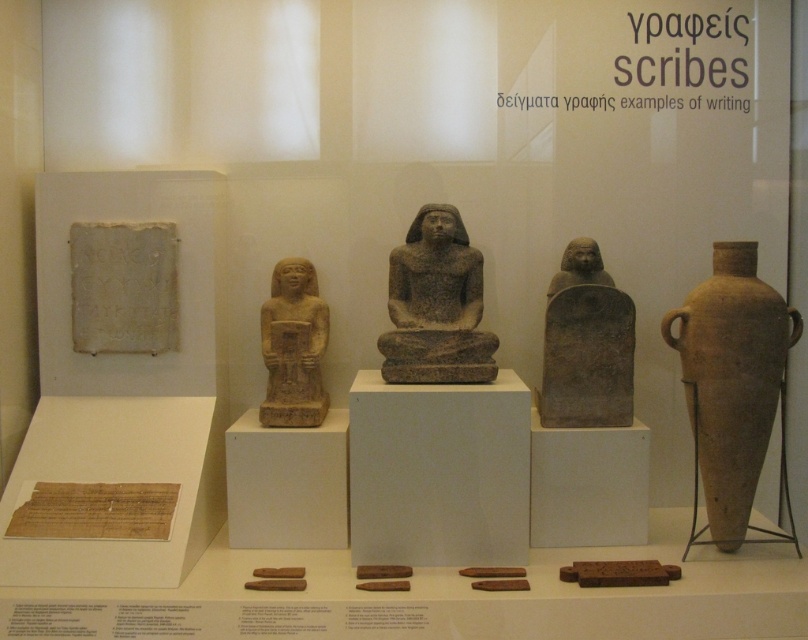
Can you confirm if brown matte vase at right is positioned to the right of beige stone statue at center?

Correct, you'll find brown matte vase at right to the right of beige stone statue at center.

Between point (781, 392) and point (306, 275), which one is positioned in front?

Point (781, 392)

I want to click on brown matte vase at right, so click(x=733, y=388).

Between brown matte vase at right and gray stone stele at center, which one is positioned higher?

gray stone stele at center is above.

Does point (697, 458) come farther from viewer compared to point (574, 368)?

No.

Which is in front, point (794, 339) or point (588, 346)?

Point (794, 339) is in front.

Locate an element on the screen. The image size is (808, 640). brown matte vase at right is located at coordinates (733, 388).

Is point (617, 372) positioned behind point (263, 358)?

No.

Is gray stone stele at center wider than beige stone statue at center?

Yes.

Does point (600, 410) lie in front of point (308, 308)?

Yes, point (600, 410) is closer to viewer.

Identify the location of gray stone stele at center. (586, 344).